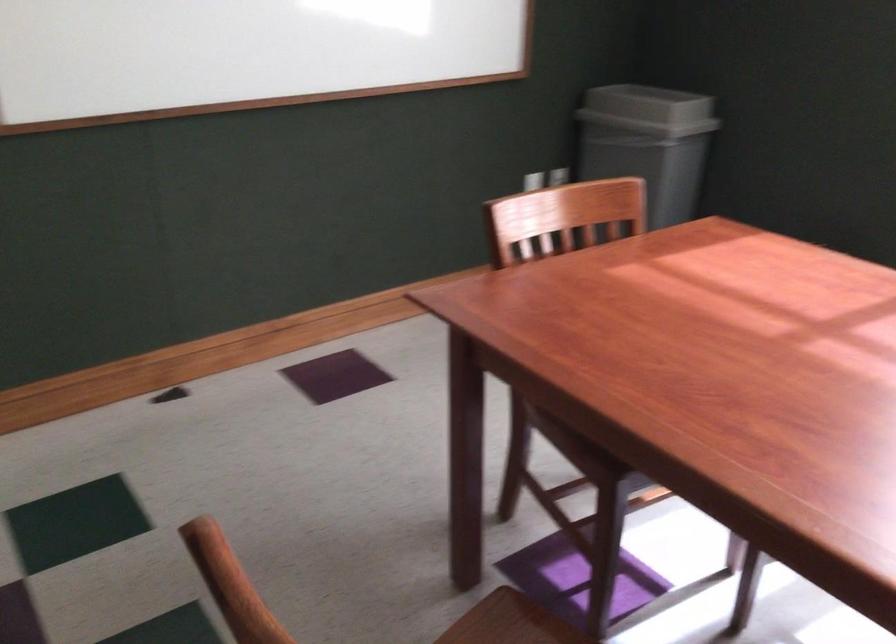
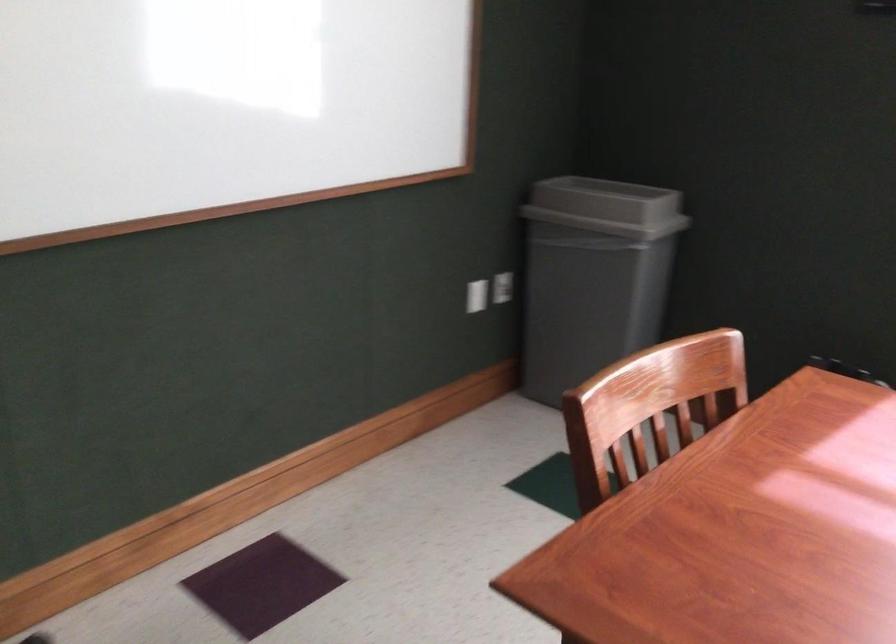
Locate, in the second image, the point that corresponds to (x=642, y=108) in the first image.

(607, 207)